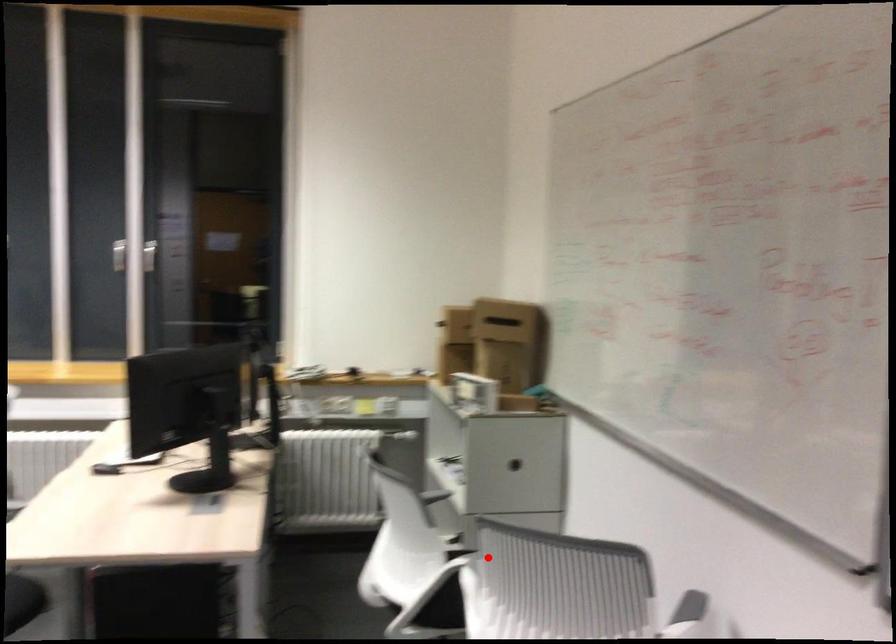
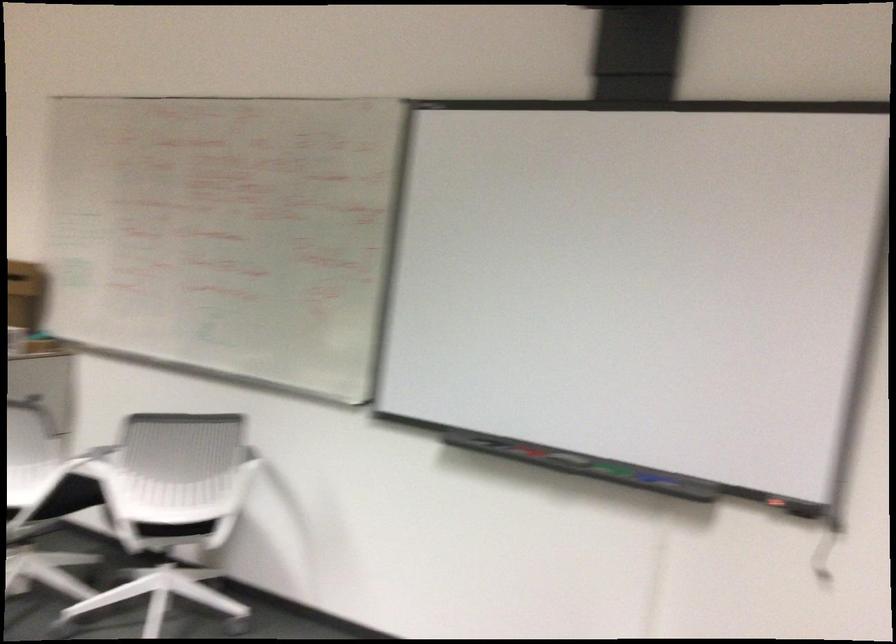
Question: I am providing you with two images of the same scene from different viewpoints. A red point is marked on the first image. Can you still see the location of the red point in image 2?

Choices:
 (A) Yes
 (B) No

Answer: (A)